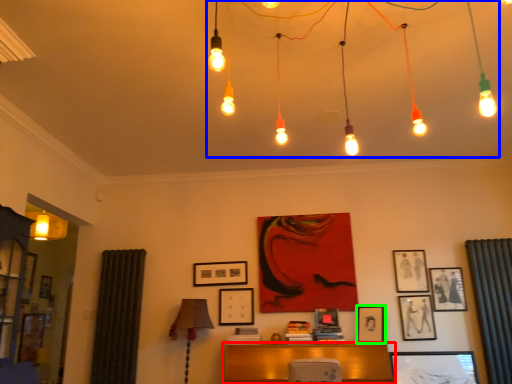
Question: Which object is the farthest from furniture (highlighted by a red box)? Choose among these: chandelier (highlighted by a blue box) or picture frame (highlighted by a green box).

Choices:
 (A) chandelier
 (B) picture frame

Answer: (A)